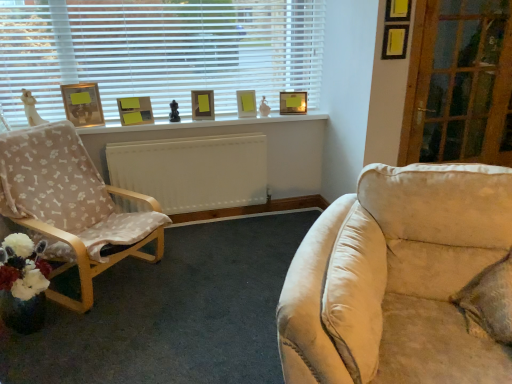
Question: From a real-world perspective, is matte gold picture frame at upper center, the 3th picture frame when ordered from right to left, under matte wooden picture frame at upper center, positioned as the 1th picture frame in right-to-left order?

Choices:
 (A) no
 (B) yes

Answer: (A)

Question: Is matte gold picture frame at upper center, marked as the third picture frame in a left-to-right arrangement, turned away from matte wooden picture frame at upper center, the 5th picture frame positioned from the left?

Choices:
 (A) yes
 (B) no

Answer: (B)

Question: Does matte gold picture frame at upper center, the 3th picture frame when ordered from right to left, appear on the right side of matte wooden picture frame at upper center, the 5th picture frame positioned from the left?

Choices:
 (A) yes
 (B) no

Answer: (B)

Question: Considering the relative sizes of matte gold picture frame at upper center, the 3th picture frame when ordered from right to left, and matte wooden picture frame at upper center, positioned as the 1th picture frame in right-to-left order, in the image provided, is matte gold picture frame at upper center, the 3th picture frame when ordered from right to left, bigger than matte wooden picture frame at upper center, positioned as the 1th picture frame in right-to-left order,?

Choices:
 (A) yes
 (B) no

Answer: (A)

Question: Considering the relative positions of matte gold picture frame at upper center, marked as the third picture frame in a left-to-right arrangement, and matte wooden picture frame at upper center, positioned as the 1th picture frame in right-to-left order, in the image provided, is matte gold picture frame at upper center, marked as the third picture frame in a left-to-right arrangement, in front of matte wooden picture frame at upper center, positioned as the 1th picture frame in right-to-left order,?

Choices:
 (A) no
 (B) yes

Answer: (B)

Question: Is matte gold picture frame at upper center, the 3th picture frame when ordered from right to left, touching matte wooden picture frame at upper center, the 5th picture frame positioned from the left?

Choices:
 (A) yes
 (B) no

Answer: (B)

Question: From the image's perspective, is matte yellow picture frame at upper center, the fourth picture frame positioned from the left, on matte wooden picture frame at center, the 4th picture frame positioned from the right?

Choices:
 (A) no
 (B) yes

Answer: (B)

Question: From a real-world perspective, is matte yellow picture frame at upper center, which is the second picture frame in right-to-left order, on matte wooden picture frame at center, which ranks as the 2th picture frame in left-to-right order?

Choices:
 (A) yes
 (B) no

Answer: (B)

Question: Is matte wooden picture frame at center, which ranks as the 2th picture frame in left-to-right order, inside matte yellow picture frame at upper center, which is the second picture frame in right-to-left order?

Choices:
 (A) no
 (B) yes

Answer: (A)

Question: Is matte yellow picture frame at upper center, the fourth picture frame positioned from the left, behind matte wooden picture frame at center, which ranks as the 2th picture frame in left-to-right order?

Choices:
 (A) no
 (B) yes

Answer: (B)

Question: Can you see matte yellow picture frame at upper center, the fourth picture frame positioned from the left, touching matte wooden picture frame at center, the 4th picture frame positioned from the right?

Choices:
 (A) no
 (B) yes

Answer: (A)

Question: Is matte yellow picture frame at upper center, the fourth picture frame positioned from the left, at the right side of matte wooden picture frame at center, the 4th picture frame positioned from the right?

Choices:
 (A) yes
 (B) no

Answer: (A)

Question: Considering the relative sizes of white plastic blinds at upper left and white painted wood at upper center in the image provided, is white plastic blinds at upper left smaller than white painted wood at upper center?

Choices:
 (A) no
 (B) yes

Answer: (A)